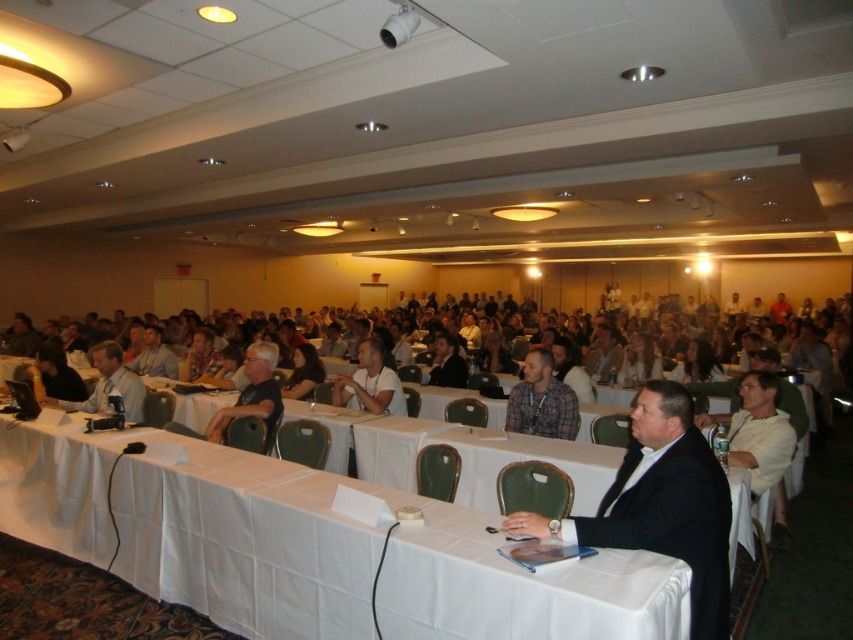
You are a photographer setting up for an event in the conference room. You need to position a camera so it can capture both the white cloth at center and the matte black laptop at left clearly. Based on their positions, which object should be placed closer to the camera to ensure both are in focus?

The white cloth at center is located below the matte black laptop at left. To ensure both are in focus, the camera should be positioned so that the matte black laptop at left is closer to the camera since it is above the white cloth at center.

You are standing at the entrance of the conference room and notice the white cloth at center. Can you determine its exact position using the coordinate system provided?

The white cloth at center is located at point (308, 547).

You are organizing a presentation and need to place a matte black laptop at left on the white cloth at center. Will the laptop fit on the cloth?

The white cloth at center might be wider than matte black laptop at left, so there is a possibility that the laptop will fit, but it is uncertain due to the comparative description.